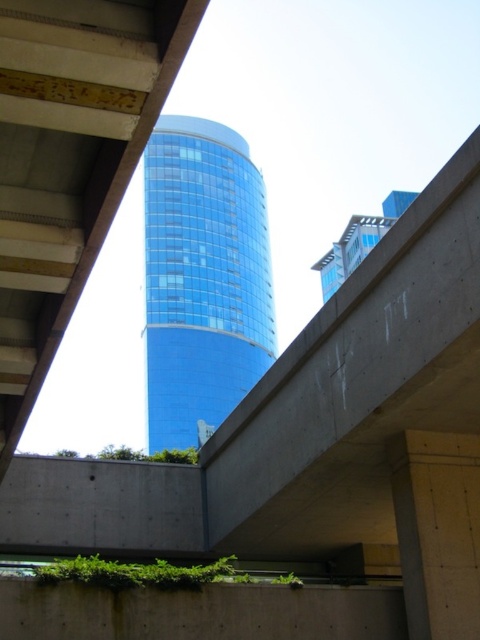
You are a photographer standing in front of the blue glassy tower at center and the concrete at center. Which object should you focus on if you want to capture the one that is positioned to the left?

The blue glassy tower at center is to the left of the concrete at center, so you should focus on the blue glassy tower at center to capture the one on the left.

You are standing in the urban area and want to take a photo of the blue glassy tower at center and the concrete at center. Which object should you focus on first if you want both to be in sharp focus?

You should focus on the blue glassy tower at center first because it is closer to you than the concrete at center, allowing both to be in focus when using a small aperture or adjusting the focal point appropriately.

You are standing at the point marked as point (203, 276) in the urban scene. Which object are you closest to?

You are closest to the blue glassy tower at center because the point (203, 276) is on the blue glassy tower at center.